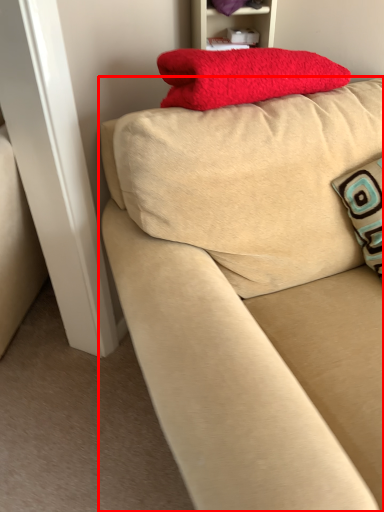
Question: From the image's perspective, where is studio couch (annotated by the red box) located in relation to furniture in the image?

Choices:
 (A) below
 (B) above

Answer: (A)